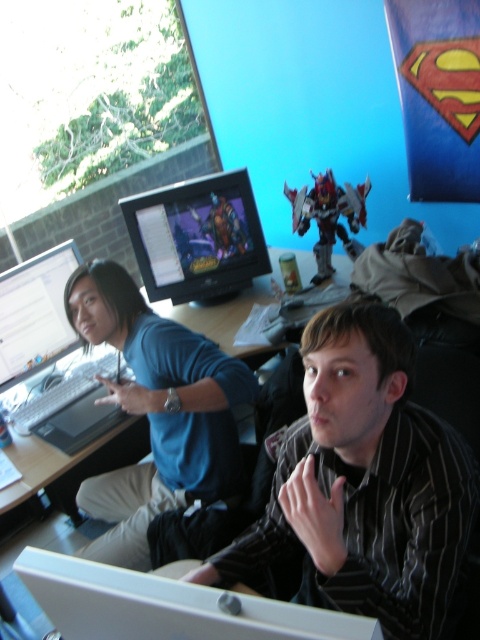
Question: Which is nearer to the metallic silver robot at center?

Choices:
 (A) matte blue shirt at left
 (B) striped shirt at center

Answer: (A)

Question: Does striped shirt at center appear on the left side of matte blue shirt at left?

Choices:
 (A) no
 (B) yes

Answer: (A)

Question: Which object is positioned farthest from the striped shirt at center?

Choices:
 (A) matte blue shirt at left
 (B) matte black monitor at center
 (C) matte black monitor at left
 (D) metallic silver robot at center

Answer: (C)

Question: Is striped shirt at center thinner than metallic silver robot at center?

Choices:
 (A) no
 (B) yes

Answer: (A)

Question: Can you confirm if matte black monitor at left is thinner than metallic silver robot at center?

Choices:
 (A) yes
 (B) no

Answer: (A)

Question: Which object is positioned farthest from the matte black monitor at left?

Choices:
 (A) matte blue shirt at left
 (B) metallic silver robot at center

Answer: (B)